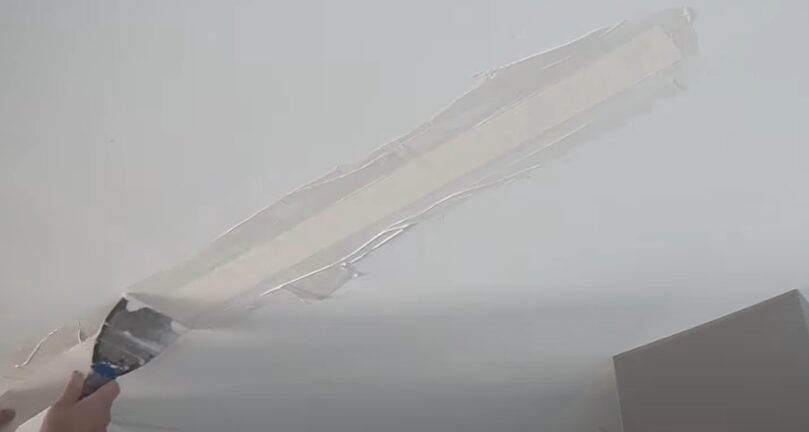
Find the location of `paint`. paint is located at coordinates [375, 172].